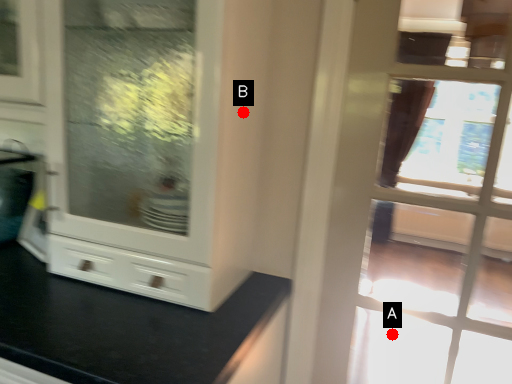
Question: Two points are circled on the image, labeled by A and B beside each circle. Which point appears closest to the camera in this image?

Choices:
 (A) A is closer
 (B) B is closer

Answer: (B)